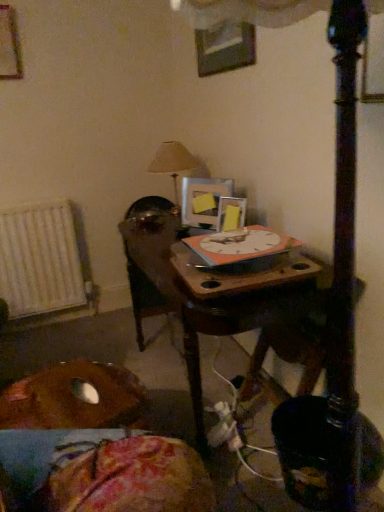
Question: From a real-world perspective, is wooden picture frame at upper left, marked as the 4th picture frame in a bottom-to-top arrangement, positioned under beige fabric lampshade at upper center based on gravity?

Choices:
 (A) yes
 (B) no

Answer: (B)

Question: Can you confirm if wooden picture frame at upper left, the 4th picture frame from the right, is bigger than beige fabric lampshade at upper center?

Choices:
 (A) yes
 (B) no

Answer: (B)

Question: Does wooden picture frame at upper left, marked as the 4th picture frame in a bottom-to-top arrangement, have a greater height compared to beige fabric lampshade at upper center?

Choices:
 (A) no
 (B) yes

Answer: (A)

Question: Is wooden picture frame at upper left, marked as the 4th picture frame in a bottom-to-top arrangement, next to beige fabric lampshade at upper center and touching it?

Choices:
 (A) yes
 (B) no

Answer: (B)

Question: Does wooden picture frame at upper left, the 4th picture frame from the right, contain beige fabric lampshade at upper center?

Choices:
 (A) no
 (B) yes

Answer: (A)

Question: Can you confirm if wooden picture frame at upper left, the 4th picture frame from the right, is shorter than beige fabric lampshade at upper center?

Choices:
 (A) no
 (B) yes

Answer: (B)

Question: Is metallic silver picture frame at upper center, the 3th picture frame when ordered from left to right, located within yellow matte picture frame at upper center, marked as the second picture frame in a bottom-to-top arrangement?

Choices:
 (A) yes
 (B) no

Answer: (B)

Question: Is yellow matte picture frame at upper center, which is the 2th picture frame in left-to-right order, turned away from metallic silver picture frame at upper center, the 2th picture frame when ordered from top to bottom?

Choices:
 (A) yes
 (B) no

Answer: (B)

Question: From the image's perspective, is yellow matte picture frame at upper center, placed as the third picture frame when sorted from right to left, located above metallic silver picture frame at upper center, the second picture frame viewed from the right?

Choices:
 (A) no
 (B) yes

Answer: (A)

Question: Does yellow matte picture frame at upper center, placed as the third picture frame when sorted from right to left, appear on the right side of metallic silver picture frame at upper center, the 2th picture frame when ordered from top to bottom?

Choices:
 (A) yes
 (B) no

Answer: (B)

Question: Is yellow matte picture frame at upper center, which appears as the third picture frame when viewed from the top, far away from metallic silver picture frame at upper center, the second picture frame viewed from the right?

Choices:
 (A) no
 (B) yes

Answer: (A)

Question: From the image's perspective, does yellow matte picture frame at upper center, placed as the third picture frame when sorted from right to left, appear lower than metallic silver picture frame at upper center, the second picture frame viewed from the right?

Choices:
 (A) no
 (B) yes

Answer: (B)

Question: Is wooden picture frame at upper left, acting as the first picture frame starting from the left, oriented towards brown fabric cushion at lower left?

Choices:
 (A) no
 (B) yes

Answer: (A)